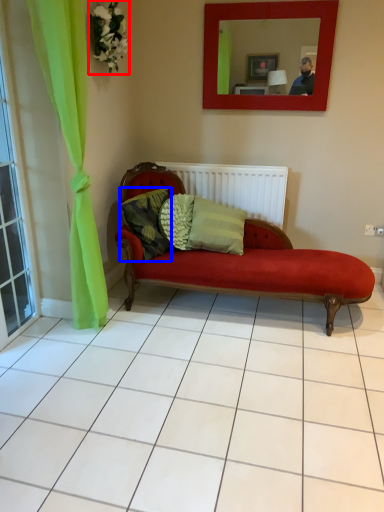
Question: Which of the following is the closest to the observer, flower (highlighted by a red box) or pillow (highlighted by a blue box)?

Choices:
 (A) flower
 (B) pillow

Answer: (A)